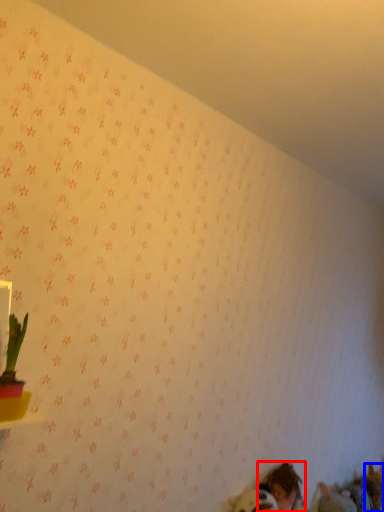
Question: Which object appears farthest to the camera in this image, person (highlighted by a red box) or animal (highlighted by a blue box)?

Choices:
 (A) person
 (B) animal

Answer: (B)